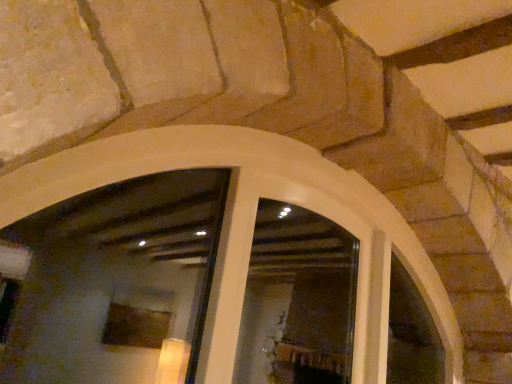
What do you see at coordinates (297, 300) in the screenshot? The width and height of the screenshot is (512, 384). I see `white glossy window at center` at bounding box center [297, 300].

Measure the distance between white glossy window at center and camera.

They are 2.99 meters apart.

You are a GUI agent. You are given a task and a screenshot of the screen. Output one action in this format:
    pyautogui.click(x=<x>, y=<y>)
    Task: Click on the white glossy window at center
    The image size is (512, 384).
    Given the screenshot: What is the action you would take?
    pyautogui.click(x=297, y=300)

Locate an element on the screen. white glossy window at center is located at coordinates point(297,300).